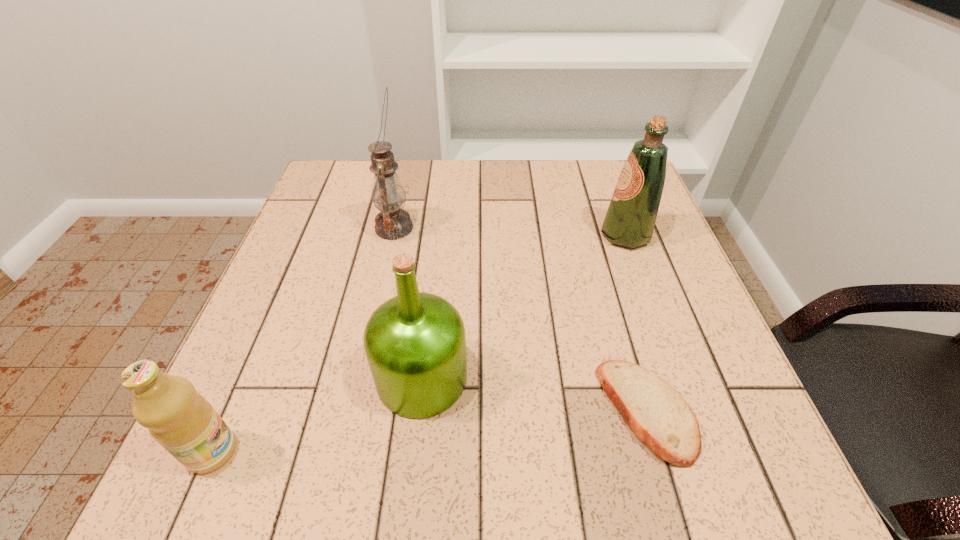
You are a GUI agent. You are given a task and a screenshot of the screen. Output one action in this format:
    pyautogui.click(x=<x>, y=<y>)
    Task: Click on the vacant space at the far edge of the desktop
    Image resolution: width=960 pixels, height=540 pixels.
    Given the screenshot: What is the action you would take?
    pyautogui.click(x=452, y=171)

Identify the location of vacant region at the near edge of the desktop. The width and height of the screenshot is (960, 540). (323, 481).

This screenshot has width=960, height=540. Find the location of `blank area at the left edge`. blank area at the left edge is located at coordinates (324, 247).

This screenshot has height=540, width=960. In the image, there is a desktop. Find the location of `free space at the right edge`. free space at the right edge is located at coordinates (644, 260).

Where is `vacant space at the near left corner of the desktop`? The image size is (960, 540). vacant space at the near left corner of the desktop is located at coordinates (217, 476).

The image size is (960, 540). In order to click on vacant space at the far right corner of the desktop in this screenshot , I will do `click(589, 206)`.

Where is `vacant area at the near right corner`? Image resolution: width=960 pixels, height=540 pixels. vacant area at the near right corner is located at coordinates (744, 435).

Identify the location of free spot between the farthest olive oil and the oil lamp. (510, 232).

Image resolution: width=960 pixels, height=540 pixels. I want to click on vacant space that's between the oil lamp and the farthest olive oil, so tap(510, 232).

This screenshot has height=540, width=960. Identify the location of empty space between the shortest olive oil and the second nearest olive oil. (317, 415).